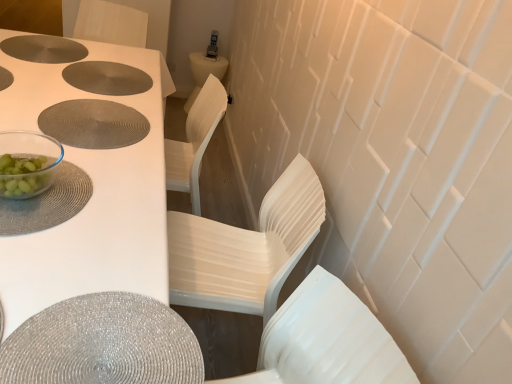
Locate an element on the screen. vacant space underneath matte silver placemat at center, which ranks as the first hole in bottom-to-top order (from a real-world perspective) is located at coordinates (89, 117).